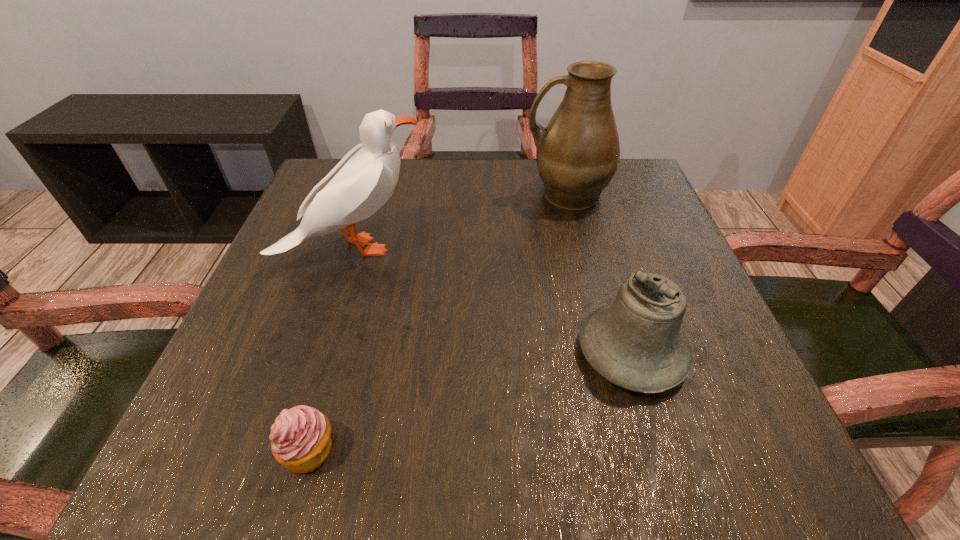
Where is `the farthest object`? The height and width of the screenshot is (540, 960). the farthest object is located at coordinates (577, 154).

This screenshot has width=960, height=540. I want to click on the second farthest object, so click(x=363, y=181).

Locate an element on the screen. the second nearest object is located at coordinates (636, 343).

Find the location of `bell`. bell is located at coordinates (636, 343).

The height and width of the screenshot is (540, 960). Identify the location of the shortest object. pyautogui.click(x=300, y=438).

In order to click on cupcake in this screenshot , I will do `click(300, 438)`.

The height and width of the screenshot is (540, 960). I want to click on vacant space located on the handle side of the pitcher, so coord(372,194).

Identify the location of vacant area situated on the handle side of the pitcher. (424, 194).

Where is `vacant position located 0.070m on the handle side of the pitcher`? vacant position located 0.070m on the handle side of the pitcher is located at coordinates (493, 194).

Find the location of a particular element. Image resolution: width=960 pixels, height=540 pixels. free spot located at the beak of the gull is located at coordinates (510, 248).